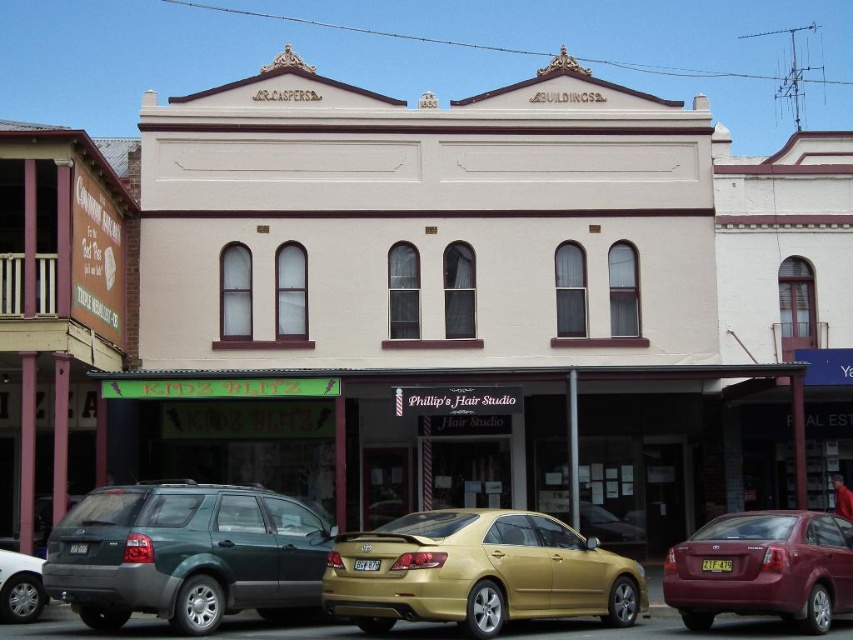
You are a delivery driver who needs to park your truck between the green matte suv at lower left and the silver metallic sedan at lower left. Your truck is 2.5 meters wide. Can you fit your truck in the space between them?

The green matte suv at lower left is wider than the silver metallic sedan at lower left. However, the exact width of the space between them isn

You are a delivery person who needs to park your vehicle in the parking lot near the KIDZ BLITZ shop. The parking space is only 1.8 meters in height. Which vehicle between the green matte suv at lower left and the silver metallic sedan at lower left can you safely park without exceeding the height limit?

The silver metallic sedan at lower left can be safely parked as it is shorter than the green matte suv at lower left, and thus likely under the 1.8 meters height limit.

You are a delivery driver who needs to park your vehicle in the parking lot near the GRASPERS BUILDINGS. You see a maroon metallic sedan at lower right and a metallic gold sedan at center. Which vehicle is parked closer to the GRASPERS BUILDINGS sign?

The maroon metallic sedan at lower right is above the metallic gold sedan at center, so it is closer to the GRASPERS BUILDINGS sign.